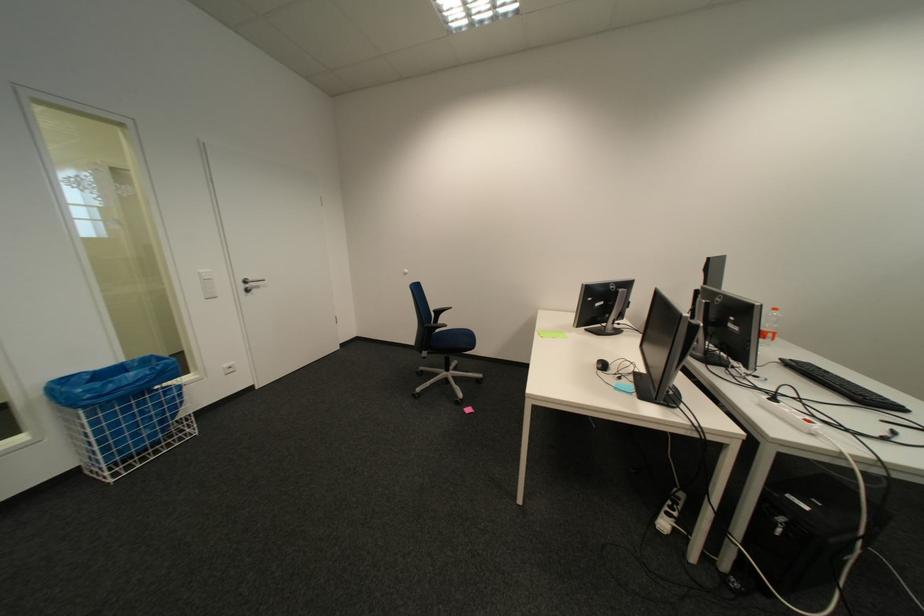
The image size is (924, 616). Identify the location of power strip switch. (670, 512).